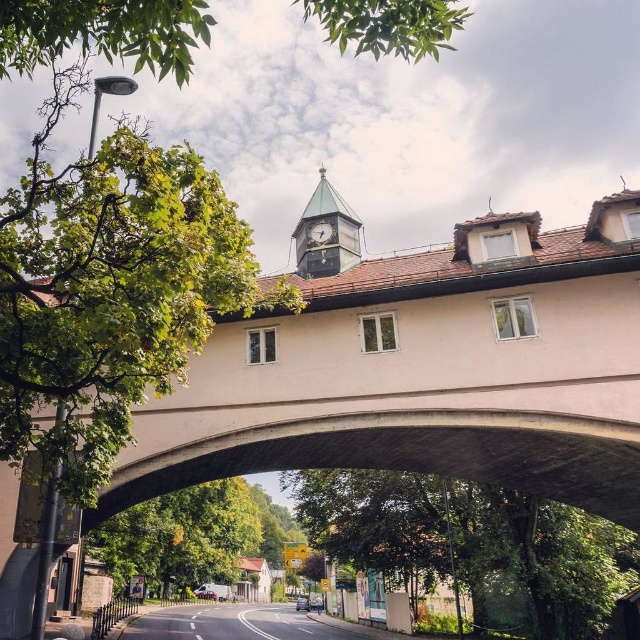
Question: Which of these objects is positioned closest to the green glass clock tower at upper center?

Choices:
 (A) smooth concrete bridge at center
 (B) metallic clock at center

Answer: (B)

Question: Which of the following is the closest to the observer?

Choices:
 (A) (317, 230)
 (B) (349, 209)

Answer: (A)

Question: Considering the relative positions of smooth concrete bridge at center and metallic clock at center in the image provided, where is smooth concrete bridge at center located with respect to metallic clock at center?

Choices:
 (A) below
 (B) above

Answer: (A)

Question: Is green glass clock tower at upper center thinner than metallic clock at center?

Choices:
 (A) yes
 (B) no

Answer: (B)

Question: Does green glass clock tower at upper center have a lesser width compared to metallic clock at center?

Choices:
 (A) yes
 (B) no

Answer: (B)

Question: Estimate the real-world distances between objects in this image. Which object is farther from the smooth concrete bridge at center?

Choices:
 (A) metallic clock at center
 (B) green glass clock tower at upper center

Answer: (A)